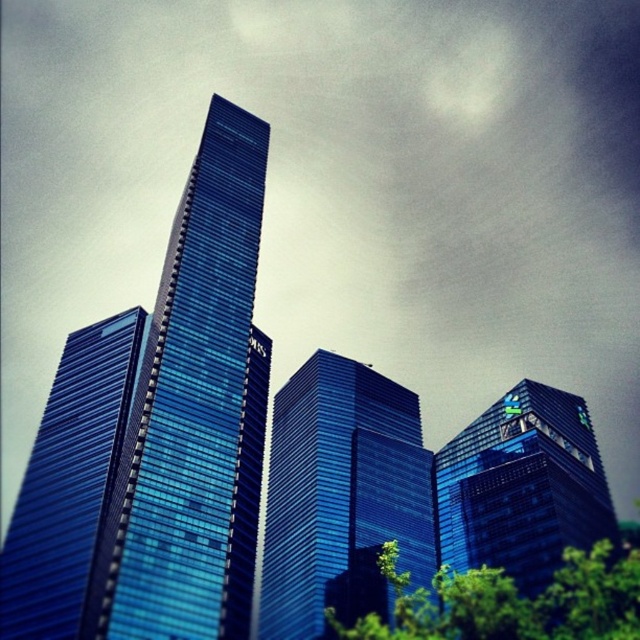
Between glossy glass skyscraper at left and green leafy tree at lower center, which one appears on the right side from the viewer's perspective?

green leafy tree at lower center

Can you confirm if glossy glass skyscraper at left is positioned to the left of green leafy tree at lower center?

Correct, you'll find glossy glass skyscraper at left to the left of green leafy tree at lower center.

Is point (42, 476) positioned before point (576, 561)?

No, (42, 476) is further to viewer.

Locate an element on the screen. This screenshot has width=640, height=640. glossy glass skyscraper at left is located at coordinates point(68,481).

Does glossy glass building at upper right lie behind green leafy tree at lower center?

Yes.

Looking at this image, which is more to the left, glossy glass building at upper right or green leafy tree at lower center?

Positioned to the left is green leafy tree at lower center.

Find the location of a particular element. glossy glass building at upper right is located at coordinates (522, 486).

Identify the location of glossy glass building at upper right. The image size is (640, 640). (522, 486).

Does point (196, 208) come farther from viewer compared to point (472, 577)?

Yes, it is behind point (472, 577).

This screenshot has height=640, width=640. Find the location of `blue glass skyscraper at center`. blue glass skyscraper at center is located at coordinates (195, 413).